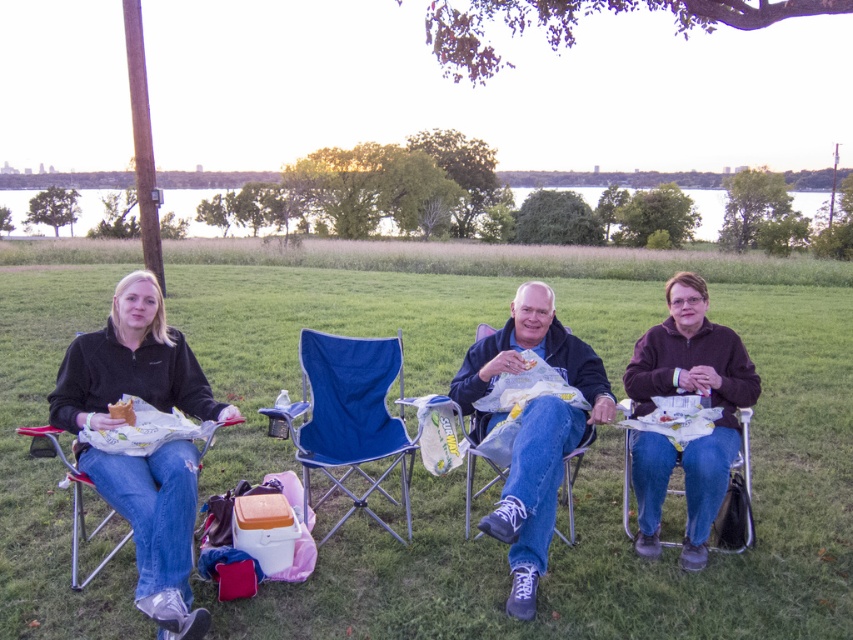
Question: Can you confirm if brown fuzzy sweater at right is bigger than golden crispy chicken at left?

Choices:
 (A) yes
 (B) no

Answer: (A)

Question: Which point is farther from the camera taking this photo?

Choices:
 (A) (397, 358)
 (B) (743, 531)

Answer: (A)

Question: Can you confirm if black fleece jacket at left is wider than golden crispy chicken at left?

Choices:
 (A) no
 (B) yes

Answer: (B)

Question: Which of these objects is positioned closest to the green grass at center?

Choices:
 (A) dark blue fabric jacket at center
 (B) blue fabric chair at lower right
 (C) brown fuzzy sweater at right
 (D) golden crispy chicken at left

Answer: (A)

Question: Which point is farther to the camera?

Choices:
 (A) (143, 316)
 (B) (134, 419)
 (C) (726, 550)
 (D) (519, 499)

Answer: (C)

Question: Is green grass at center thinner than dark blue fabric jacket at center?

Choices:
 (A) no
 (B) yes

Answer: (A)